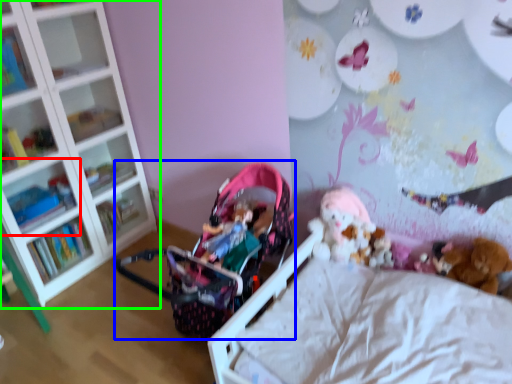
Question: Which object is the farthest from shelf (highlighted by a red box)? Choose among these: baby carriage (highlighted by a blue box) or shelf (highlighted by a green box).

Choices:
 (A) baby carriage
 (B) shelf

Answer: (A)